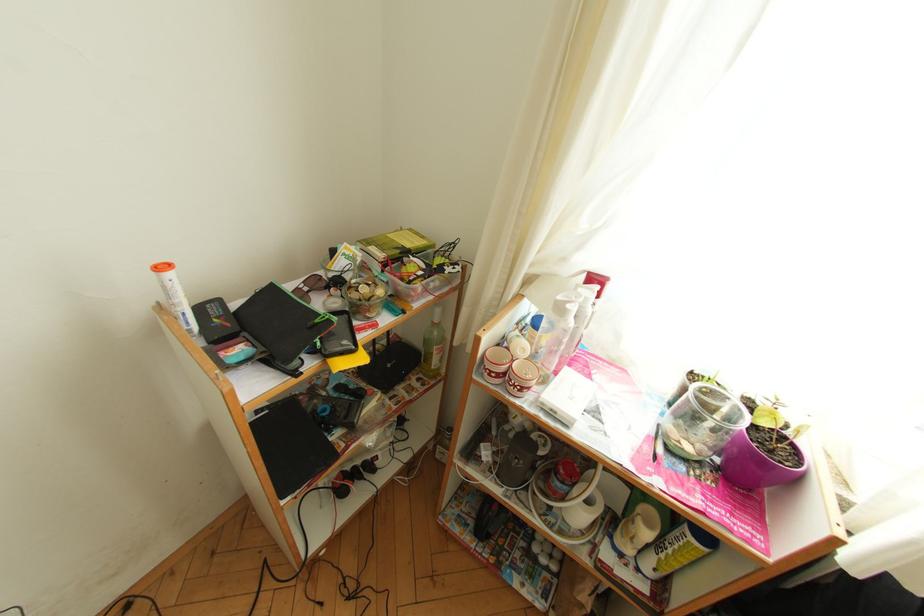
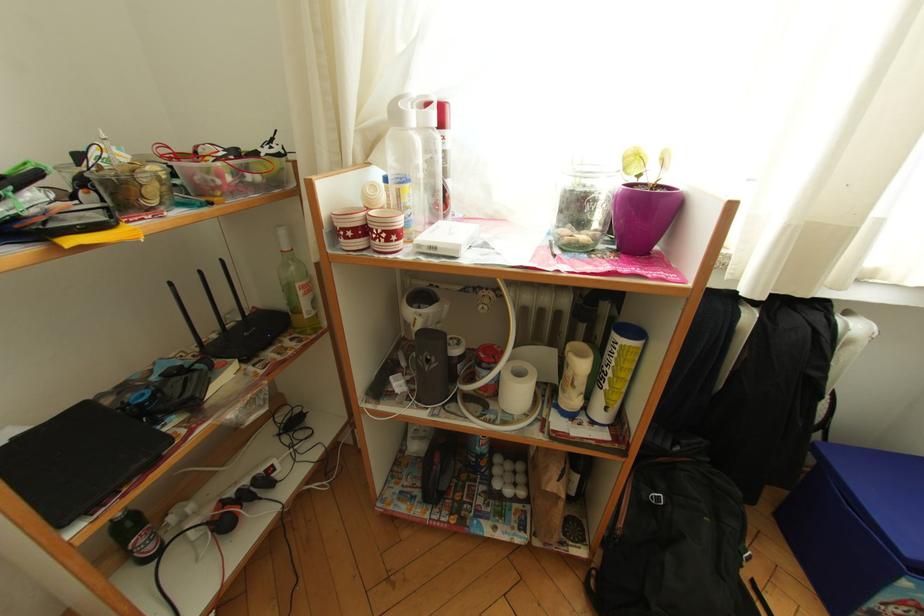
What movement of the cameraman would produce the second image?

The movement direction of the cameraman is right, forward.